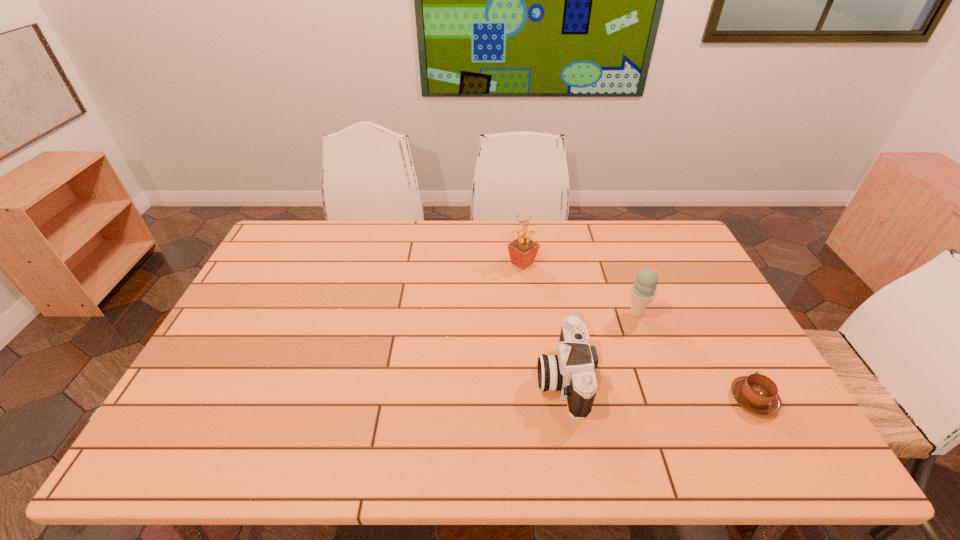
At what (x,y) coordinates should I click in order to perform the action: click on vacant region between the sunflower and the camera. Please return your answer as a coordinate pair (x, y). The height and width of the screenshot is (540, 960). Looking at the image, I should click on (542, 321).

Select which object appears as the closest to the camera. Please provide its 2D coordinates. Your answer should be formatted as a tuple, i.e. [(x, y)], where the tuple contains the x and y coordinates of a point satisfying the conditions above.

[(643, 291)]

At what (x,y) coordinates should I click in order to perform the action: click on object that can be found as the second closest to the camera. Please return your answer as a coordinate pair (x, y). The width and height of the screenshot is (960, 540). Looking at the image, I should click on (523, 250).

I want to click on free spot that satisfies the following two spatial constraints: 1. at the front of the farthest object with flowers visible; 2. on the side of the rightmost object with the handle, so click(538, 399).

The image size is (960, 540). Find the location of `vacant point that satisfies the following two spatial constraints: 1. at the front of the second farthest object with flowers visible; 2. on the right side of the farthest object`. vacant point that satisfies the following two spatial constraints: 1. at the front of the second farthest object with flowers visible; 2. on the right side of the farthest object is located at coordinates (528, 313).

The image size is (960, 540). What are the coordinates of `free space in the image that satisfies the following two spatial constraints: 1. on the side of the shortest object with the handle; 2. at the front of the farthest object with flowers visible` in the screenshot? It's located at (680, 263).

What are the coordinates of `vacant region that satisfies the following two spatial constraints: 1. on the back side of the camera; 2. on the left side of the third nearest object` in the screenshot? It's located at (551, 313).

Find the location of a particular element. free location that satisfies the following two spatial constraints: 1. at the front of the farthest object with flowers visible; 2. on the back side of the camera is located at coordinates (536, 378).

Locate an element on the screen. vacant position in the image that satisfies the following two spatial constraints: 1. at the front of the farthest object with flowers visible; 2. on the side of the cappuccino with the handle is located at coordinates (538, 399).

At what (x,y) coordinates should I click in order to perform the action: click on blank space that satisfies the following two spatial constraints: 1. at the front of the farthest object with flowers visible; 2. on the left side of the second farthest object. Please return your answer as a coordinate pair (x, y). The image size is (960, 540). Looking at the image, I should click on (528, 313).